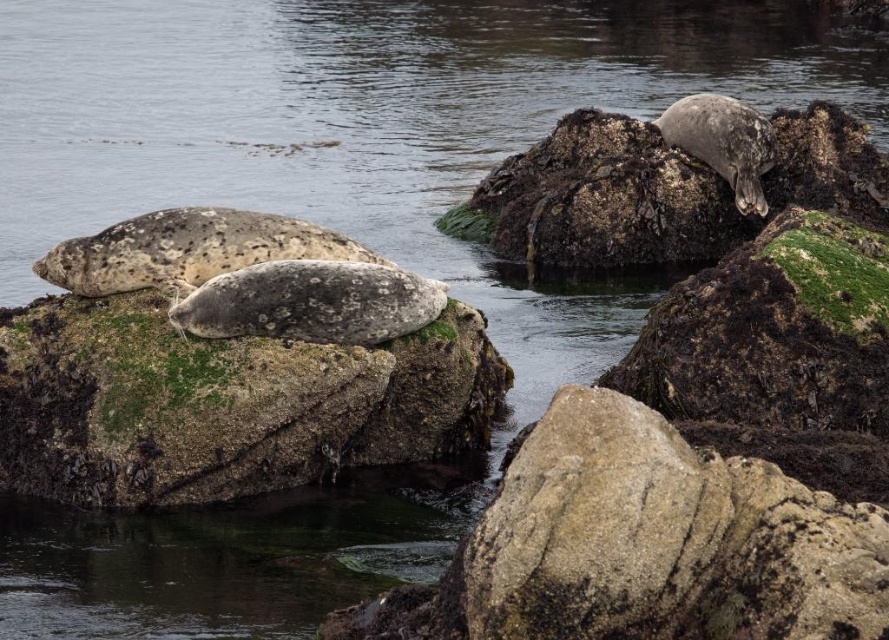
Which is below, speckled gray rock at upper right or speckled fur seal at center?

speckled fur seal at center is below.

Does speckled gray rock at upper right have a lesser height compared to speckled fur seal at center?

In fact, speckled gray rock at upper right may be taller than speckled fur seal at center.

You are a GUI agent. You are given a task and a screenshot of the screen. Output one action in this format:
    pyautogui.click(x=<x>, y=<y>)
    Task: Click on the speckled gray rock at upper right
    
    Given the screenshot: What is the action you would take?
    pyautogui.click(x=661, y=192)

Identify the location of speckled gray rock at center. This screenshot has height=640, width=889. (223, 403).

Which is more to the right, speckled gray rock at center or speckled gray rock at upper right?

speckled gray rock at upper right is more to the right.

Describe the element at coordinates (223, 403) in the screenshot. I see `speckled gray rock at center` at that location.

What are the coordinates of `speckled gray rock at center` in the screenshot? It's located at (223, 403).

Can you confirm if speckled gray rock at center is shorter than speckled fur seal at upper right?

Incorrect, speckled gray rock at center's height does not fall short of speckled fur seal at upper right's.

Which is in front, point (251, 371) or point (663, 116)?

Point (251, 371) is in front.

Measure the distance between speckled gray rock at center and camera.

speckled gray rock at center is 33.54 feet from camera.

You are a GUI agent. You are given a task and a screenshot of the screen. Output one action in this format:
    pyautogui.click(x=<x>, y=<y>)
    Task: Click on the speckled gray rock at center
    
    Given the screenshot: What is the action you would take?
    pyautogui.click(x=223, y=403)